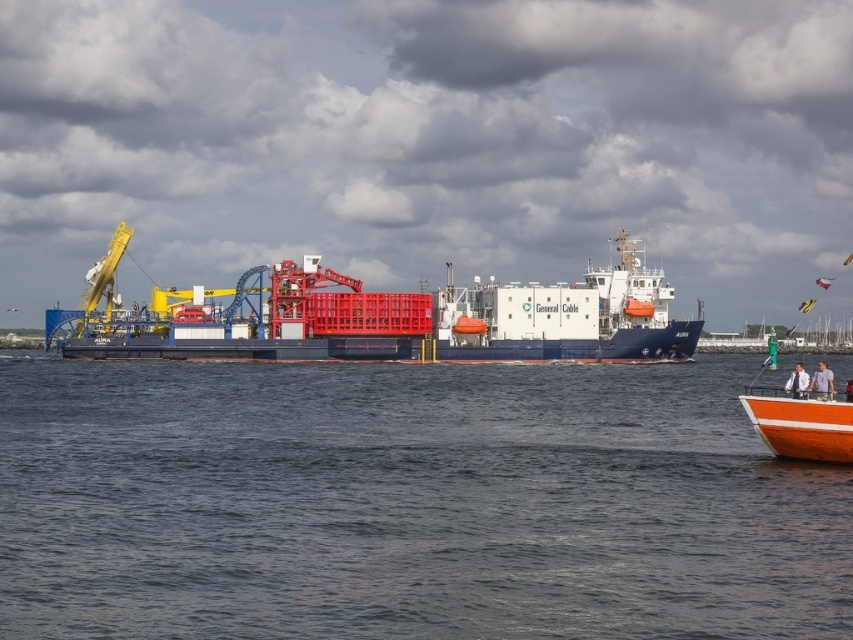
From the picture: Is dark blue water at center to the left of blue matte cargo ship at center from the viewer's perspective?

Incorrect, dark blue water at center is not on the left side of blue matte cargo ship at center.

Who is taller, dark blue water at center or blue matte cargo ship at center?

blue matte cargo ship at center

Which is in front, point (88, 458) or point (657, 323)?

Point (88, 458)

Where is `dark blue water at center`? The image size is (853, 640). dark blue water at center is located at coordinates (407, 502).